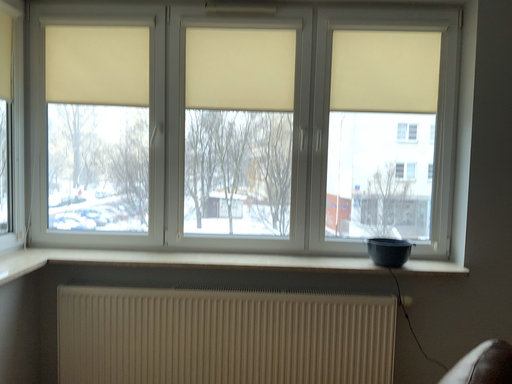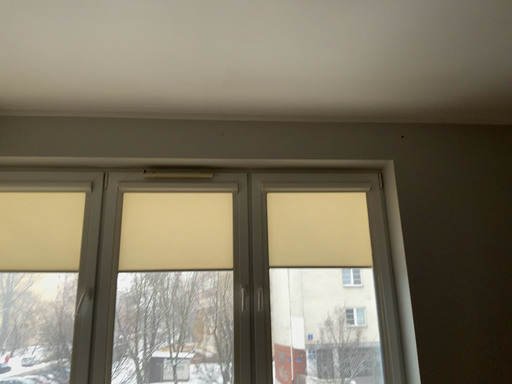
Question: Which way did the camera rotate in the video?

Choices:
 (A) rotated downward
 (B) rotated upward

Answer: (B)